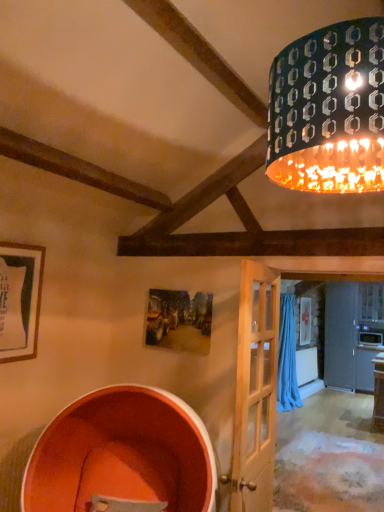
Question: Is light wood door at center taller or shorter than metallic patterned shade at upper right?

Choices:
 (A) tall
 (B) short

Answer: (A)

Question: Is point (241, 291) positioned closer to the camera than point (309, 97)?

Choices:
 (A) closer
 (B) farther

Answer: (B)

Question: Which is farther from the blue fabric curtain at right?

Choices:
 (A) matte black picture frame at left
 (B) orange matte barrel at lower left
 (C) metallic patterned shade at upper right
 (D) light wood door at center

Answer: (C)

Question: Estimate the real-world distances between objects in this image. Which object is farther from the metallic patterned shade at upper right?

Choices:
 (A) blue fabric curtain at right
 (B) matte black picture frame at left
 (C) orange matte barrel at lower left
 (D) light wood door at center

Answer: (A)